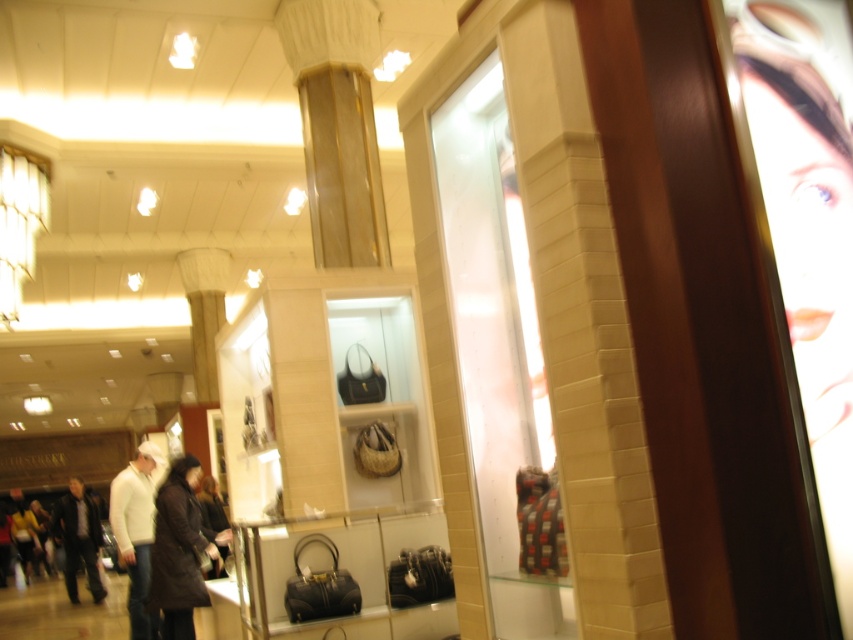
Question: Which object is closer to the camera taking this photo?

Choices:
 (A) dark brown leather jacket at lower left
 (B) dark brown leather jacket at center

Answer: (B)

Question: Can you confirm if dark brown leather jacket at center is thinner than dark brown leather jacket at lower left?

Choices:
 (A) no
 (B) yes

Answer: (B)

Question: Does dark brown leather jacket at center lie in front of dark brown leather jacket at lower left?

Choices:
 (A) no
 (B) yes

Answer: (B)

Question: Which object appears closest to the camera in this image?

Choices:
 (A) dark brown leather jacket at center
 (B) dark brown leather jacket at lower left

Answer: (A)

Question: Is dark brown leather jacket at center above dark brown leather jacket at lower left?

Choices:
 (A) no
 (B) yes

Answer: (B)